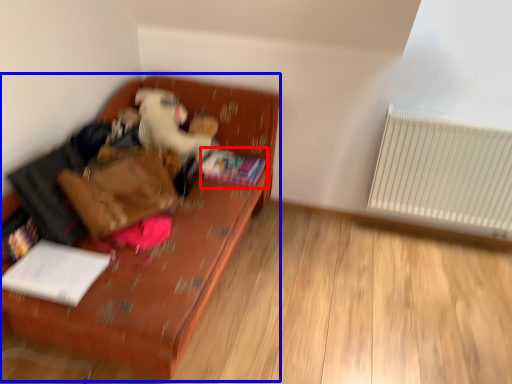
Question: Which object appears closest to the camera in this image, book (highlighted by a red box) or furniture (highlighted by a blue box)?

Choices:
 (A) book
 (B) furniture

Answer: (B)